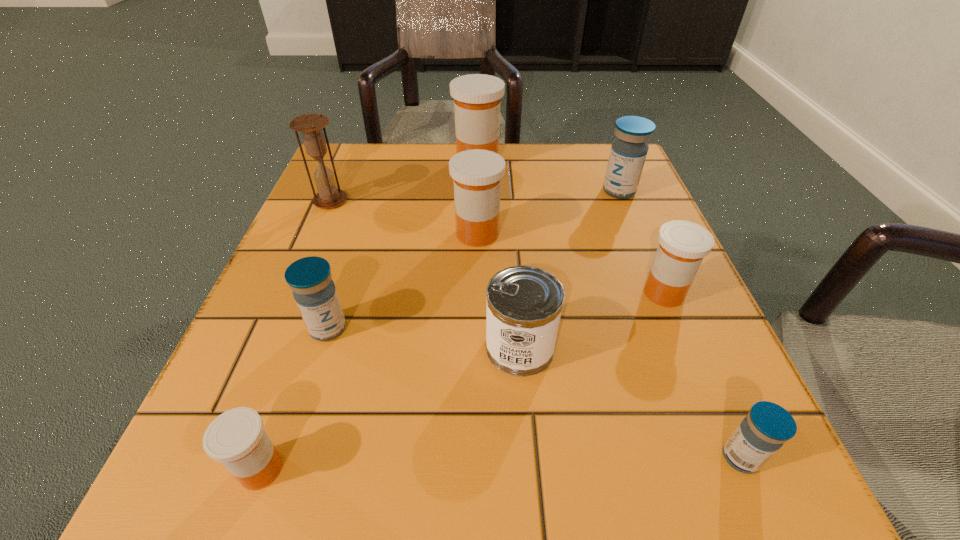
What are the coordinates of `object present at the far right corner` in the screenshot? It's located at (628, 152).

Find the location of `object located at the near right corner`. object located at the near right corner is located at coordinates (765, 429).

Identify the location of vacant space at the far edge. The width and height of the screenshot is (960, 540). (413, 143).

You are a GUI agent. You are given a task and a screenshot of the screen. Output one action in this format:
    pyautogui.click(x=<x>, y=<y>)
    Task: Click on the vacant space at the near edge of the desktop
    The height and width of the screenshot is (540, 960).
    Given the screenshot: What is the action you would take?
    pyautogui.click(x=354, y=512)

Where is `vacant space at the left edge of the desktop`? This screenshot has height=540, width=960. vacant space at the left edge of the desktop is located at coordinates (360, 295).

Identify the location of vacant position at the right edge of the desktop. The height and width of the screenshot is (540, 960). (675, 359).

Identify the location of free spot at the far left corner of the desktop. (331, 169).

Locate an element on the screen. Image resolution: width=960 pixels, height=540 pixels. vacant space at the far right corner of the desktop is located at coordinates (576, 188).

I want to click on vacant region at the near right corner of the desktop, so click(x=773, y=487).

At what (x,y) coordinates should I click in order to perform the action: click on free space between the can and the brown hourglass. Please return your answer as a coordinate pair (x, y). Image resolution: width=960 pixels, height=540 pixels. Looking at the image, I should click on (425, 274).